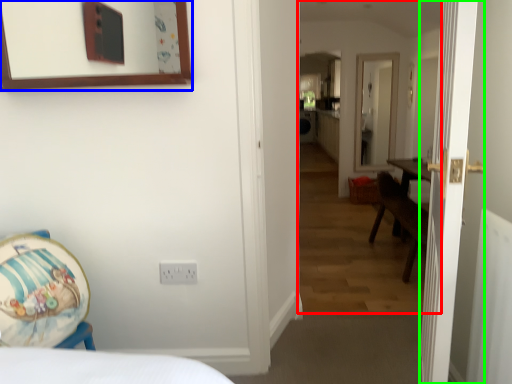
Question: Which is farther away from corridor (highlighted by a red box)? picture frame (highlighted by a blue box) or door (highlighted by a green box)?

Choices:
 (A) picture frame
 (B) door

Answer: (A)